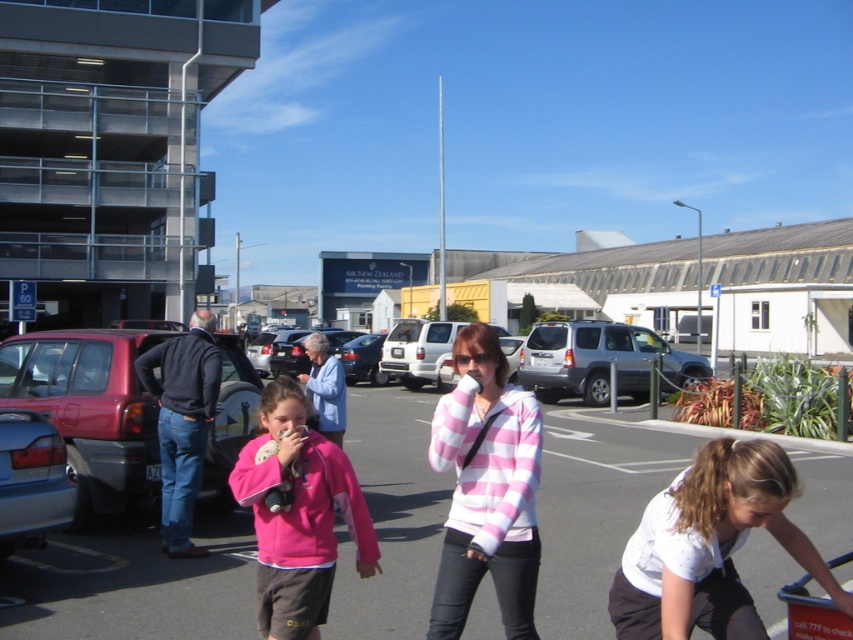
Which of these two, pink striped sweater at center or matte black car at lower left, stands shorter?

Standing shorter between the two is matte black car at lower left.

Between pink striped sweater at center and matte black car at lower left, which one appears on the left side from the viewer's perspective?

Positioned to the left is matte black car at lower left.

Identify the location of pink striped sweater at center. (486, 488).

Locate an element on the screen. This screenshot has height=640, width=853. pink striped sweater at center is located at coordinates (486, 488).

Is point (590, 454) positioned after point (412, 355)?

No, it is in front of (412, 355).

Between point (622, 492) and point (437, 349), which one is positioned in front?

Point (622, 492) is more forward.

Identify the location of smooth asphalt parking lot at center. This screenshot has width=853, height=640. (132, 582).

Can you confirm if smooth asphalt parking lot at center is wider than pink striped sweater at center?

Correct, the width of smooth asphalt parking lot at center exceeds that of pink striped sweater at center.

I want to click on smooth asphalt parking lot at center, so click(x=132, y=582).

You are a GUI agent. You are given a task and a screenshot of the screen. Output one action in this format:
    pyautogui.click(x=<x>, y=<y>)
    Task: Click on the smooth asphalt parking lot at center
    The width and height of the screenshot is (853, 640).
    Given the screenshot: What is the action you would take?
    132,582